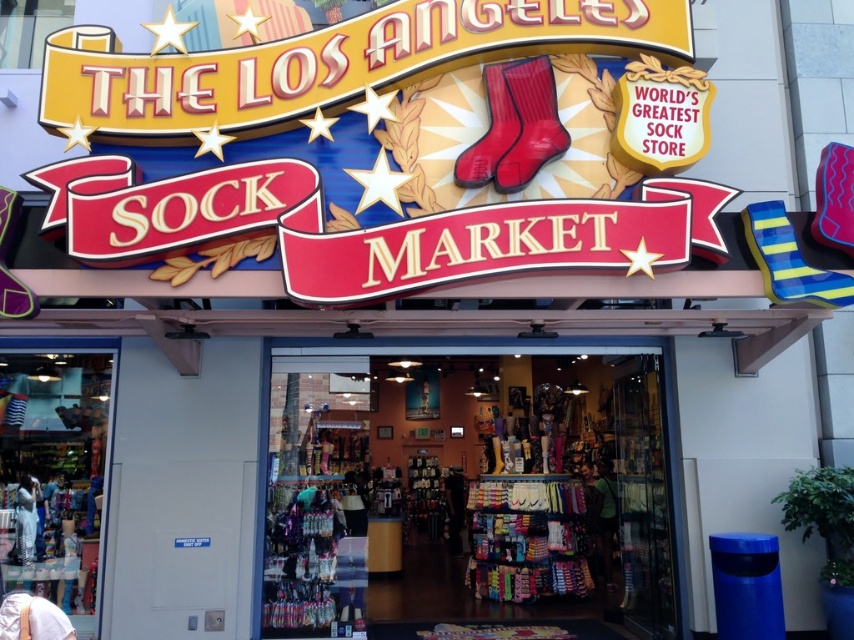
You are standing in front of the store entrance. There is a point at coordinates point [463,477]. What object is located at that point?

The point at coordinates point [463,477] corresponds to the multicolored fabric socks at center.

You are a customer trying to decide between buying the multicolored fabric socks at center or the rubberized matte red boot at upper center. Which item takes up more horizontal space on the shelf?

The rubberized matte red boot at upper center takes up more horizontal space because the multicolored fabric socks at center are narrower than it.